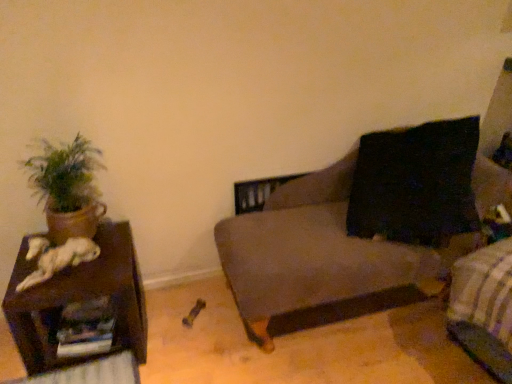
Question: From the image's perspective, is brown wooden side table at left located above or below dark gray fabric couch at center?

Choices:
 (A) below
 (B) above

Answer: (A)

Question: Based on their sizes in the image, would you say brown wooden side table at left is bigger or smaller than dark gray fabric couch at center?

Choices:
 (A) small
 (B) big

Answer: (A)

Question: Which object is positioned farthest from the green matte plant at left?

Choices:
 (A) brown wooden side table at left
 (B) dark brown fabric bed frame at lower right
 (C) dark gray fabric couch at center

Answer: (B)

Question: Which is farther from the green matte plant at left?

Choices:
 (A) dark gray fabric couch at center
 (B) dark brown fabric bed frame at lower right
 (C) brown wooden side table at left

Answer: (B)